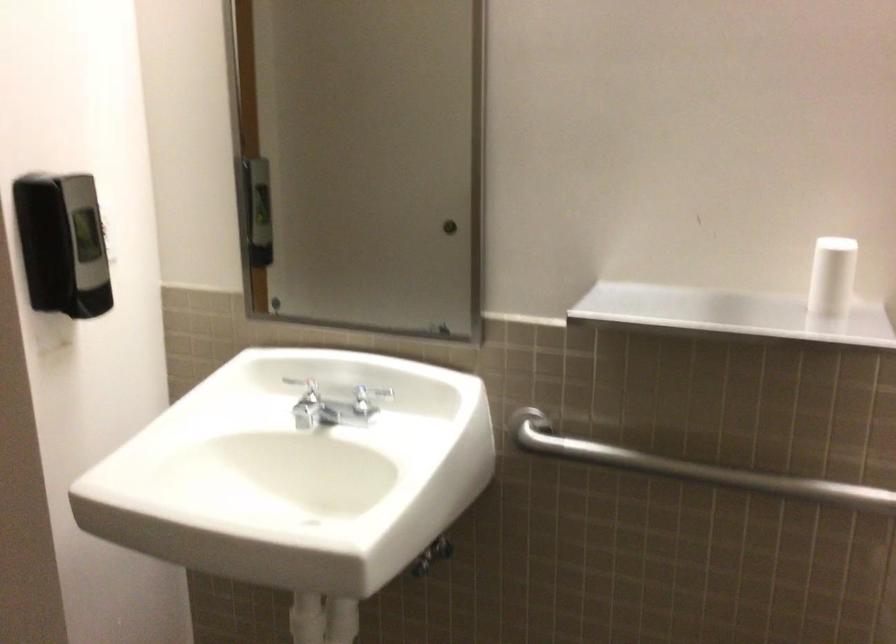
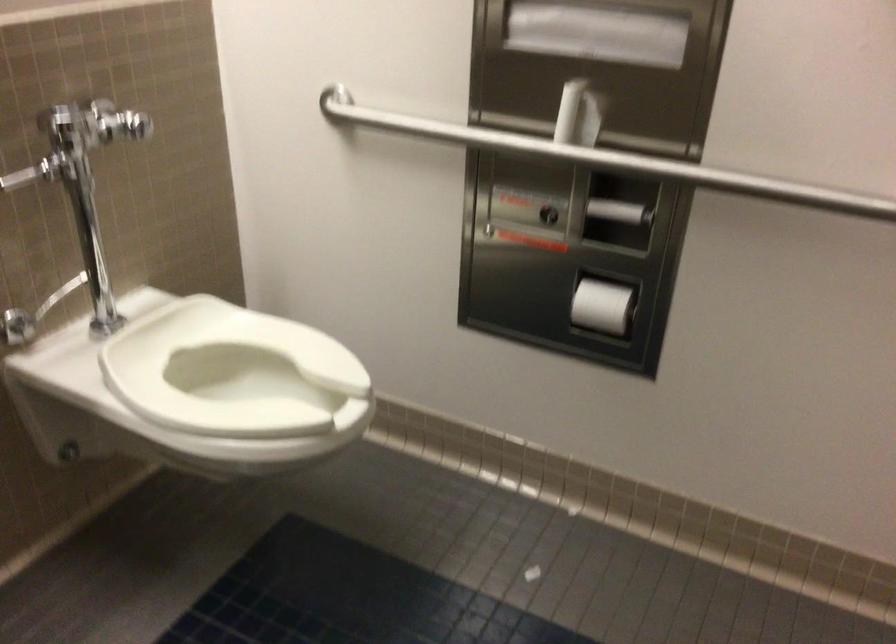
In the scene shown: The first image is from the beginning of the video and the second image is from the end. How did the camera likely rotate when shooting the video?

The rotation direction of the camera is right-down.